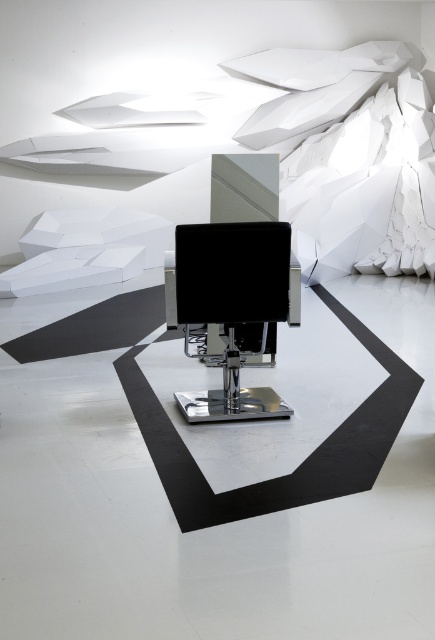
You are a customer in a modern interior design store and see the black leather sewing machine at center and the black glossy monitor at center. According to the store layout, which object is positioned to the right side?

The black leather sewing machine at center is positioned to the right of the black glossy monitor at center.